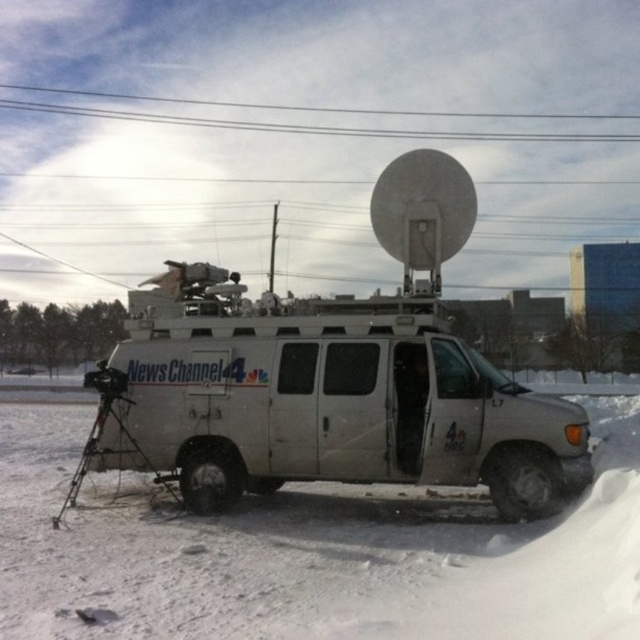
Question: Which point is farther from the camera taking this photo?

Choices:
 (A) (38, 582)
 (B) (208, 323)

Answer: (B)

Question: Does white powdery snow at lower left have a smaller size compared to black plastic video camera at lower left?

Choices:
 (A) yes
 (B) no

Answer: (A)

Question: Does white powdery snow at lower left appear over white metallic van at center?

Choices:
 (A) no
 (B) yes

Answer: (A)

Question: Which point is closer to the camera taking this photo?

Choices:
 (A) (288, 124)
 (B) (529, 579)
 (C) (116, 380)

Answer: (B)

Question: Which of these objects is positioned closest to the black plastic video camera at lower left?

Choices:
 (A) black wire at upper center
 (B) white metallic van at center
 (C) white powdery snow at lower left

Answer: (B)

Question: In this image, where is white powdery snow at lower left located relative to black matte tripod at lower left?

Choices:
 (A) right
 (B) left

Answer: (A)